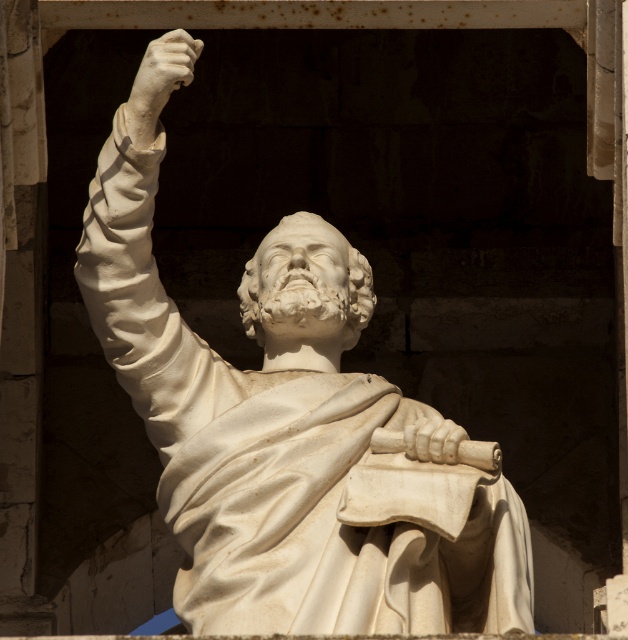
Question: Which point is closer to the camera taking this photo?

Choices:
 (A) (230, 513)
 (B) (175, 33)

Answer: (A)

Question: Is white marble statue at center further to the viewer compared to white marble hand at upper left?

Choices:
 (A) no
 (B) yes

Answer: (A)

Question: Which point is closer to the camera?

Choices:
 (A) (475, 538)
 (B) (148, 51)

Answer: (A)

Question: Can you confirm if white marble statue at center is bigger than white marble hand at upper left?

Choices:
 (A) yes
 (B) no

Answer: (A)

Question: Considering the relative positions of white marble statue at center and white marble hand at upper left in the image provided, where is white marble statue at center located with respect to white marble hand at upper left?

Choices:
 (A) below
 (B) above

Answer: (A)